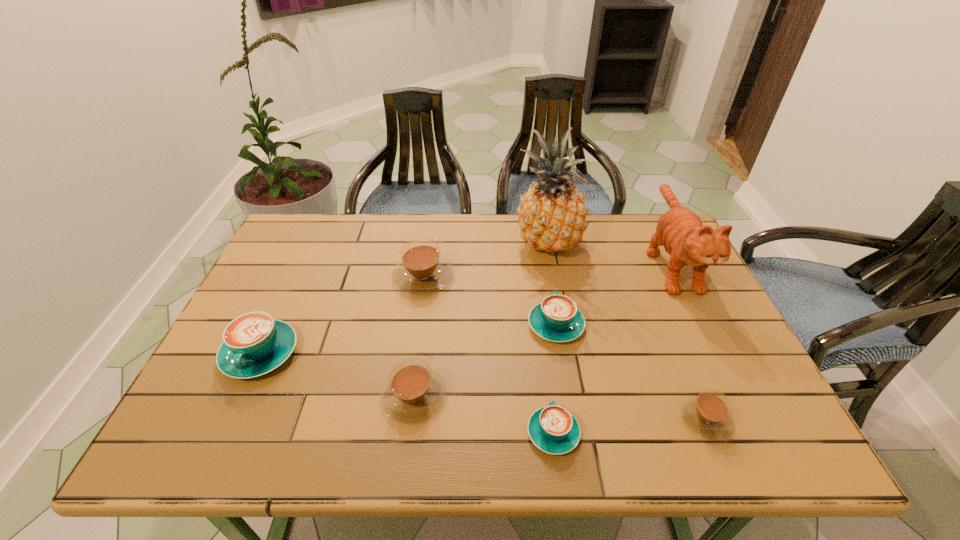
This screenshot has height=540, width=960. I want to click on the rightmost brown cappuccino, so click(x=708, y=414).

Locate an element on the screen. Image resolution: width=960 pixels, height=540 pixels. the smallest brown cappuccino is located at coordinates (708, 414).

Locate an element on the screen. The width and height of the screenshot is (960, 540). the nearest turquoise cappuccino is located at coordinates (554, 430).

At what (x,y) coordinates should I click in order to perform the action: click on blank space located 0.290m on the right of the tallest object. Please return your answer as a coordinate pair (x, y). The height and width of the screenshot is (540, 960). Looking at the image, I should click on (676, 244).

In order to click on vacant area situated on the face of the orange cat in this screenshot , I will do tap(724, 369).

This screenshot has width=960, height=540. Identify the location of free region located 0.160m on the right of the biggest brown cappuccino. (510, 276).

At what (x,y) coordinates should I click in order to perform the action: click on blank space located with the handle on the right side of the leftmost turquoise cappuccino. Please return your answer as a coordinate pair (x, y). Looking at the image, I should click on (223, 434).

Locate an element on the screen. Image resolution: width=960 pixels, height=540 pixels. free location located 0.340m on the right of the second biggest brown cappuccino is located at coordinates coord(599,397).

You are a GUI agent. You are given a task and a screenshot of the screen. Output one action in this format:
    pyautogui.click(x=<x>, y=<y>)
    Task: Click on the free location located with the handle on the right side of the second biggest turquoise cappuccino
    
    Given the screenshot: What is the action you would take?
    tap(541, 242)

Locate an element on the screen. This screenshot has height=540, width=960. blank space located with the handle on the right side of the second biggest turquoise cappuccino is located at coordinates (546, 271).